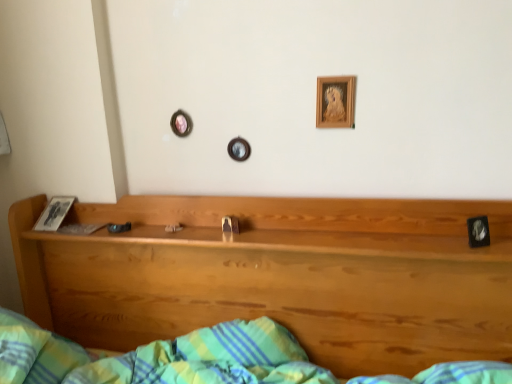
Question: From the image's perspective, is wooden headboard at center under wooden picture frame at upper center, the 1th picture frame positioned from the back?

Choices:
 (A) yes
 (B) no

Answer: (A)

Question: From a real-world perspective, is wooden headboard at center over wooden picture frame at upper center, which ranks as the 1th picture frame in top-to-bottom order?

Choices:
 (A) yes
 (B) no

Answer: (B)

Question: Does wooden headboard at center turn towards wooden picture frame at upper center, which appears as the second picture frame when ordered from the bottom?

Choices:
 (A) no
 (B) yes

Answer: (A)

Question: Is wooden headboard at center to the left of wooden picture frame at upper center, the 1th picture frame when ordered from left to right, from the viewer's perspective?

Choices:
 (A) no
 (B) yes

Answer: (B)

Question: Considering the relative positions of wooden headboard at center and wooden picture frame at upper center, arranged as the second picture frame when viewed from the right, in the image provided, is wooden headboard at center behind wooden picture frame at upper center, arranged as the second picture frame when viewed from the right,?

Choices:
 (A) yes
 (B) no

Answer: (B)

Question: In the image, is wooden picture frame at upper center, arranged as the second picture frame when viewed from the right, on the left side or the right side of wooden headboard at center?

Choices:
 (A) right
 (B) left

Answer: (A)

Question: Considering the positions of wooden picture frame at upper center, arranged as the second picture frame when viewed from the right, and wooden headboard at center in the image, is wooden picture frame at upper center, arranged as the second picture frame when viewed from the right, bigger or smaller than wooden headboard at center?

Choices:
 (A) big
 (B) small

Answer: (B)

Question: Choose the correct answer: Is wooden picture frame at upper center, which ranks as the 1th picture frame in top-to-bottom order, inside wooden headboard at center or outside it?

Choices:
 (A) outside
 (B) inside

Answer: (A)

Question: Looking at their shapes, would you say wooden picture frame at upper center, which appears as the second picture frame when ordered from the bottom, is wider or thinner than wooden headboard at center?

Choices:
 (A) thin
 (B) wide

Answer: (A)

Question: In the image, is wooden picture frame at upper center, which appears as the second picture frame when ordered from the bottom, on the left side or the right side of black glossy picture frame at right, positioned as the first picture frame in front-to-back order?

Choices:
 (A) left
 (B) right

Answer: (A)

Question: From the image's perspective, is wooden picture frame at upper center, the 1th picture frame positioned from the back, above or below black glossy picture frame at right, marked as the first picture frame in a bottom-to-top arrangement?

Choices:
 (A) above
 (B) below

Answer: (A)

Question: In the image, is wooden picture frame at upper center, the 2th picture frame from the front, positioned in front of or behind black glossy picture frame at right, which is the 2th picture frame from top to bottom?

Choices:
 (A) behind
 (B) front

Answer: (A)

Question: Is point (345, 87) positioned closer to the camera than point (484, 231)?

Choices:
 (A) farther
 (B) closer

Answer: (A)

Question: Considering the positions of black glossy picture frame at right, marked as the first picture frame in a bottom-to-top arrangement, and wooden picture frame at upper center, the 1th picture frame when ordered from left to right, in the image, is black glossy picture frame at right, marked as the first picture frame in a bottom-to-top arrangement, taller or shorter than wooden picture frame at upper center, the 1th picture frame when ordered from left to right,?

Choices:
 (A) tall
 (B) short

Answer: (B)

Question: From the image's perspective, is black glossy picture frame at right, acting as the 2th picture frame starting from the back, positioned above or below wooden picture frame at upper center, the 2th picture frame from the front?

Choices:
 (A) below
 (B) above

Answer: (A)